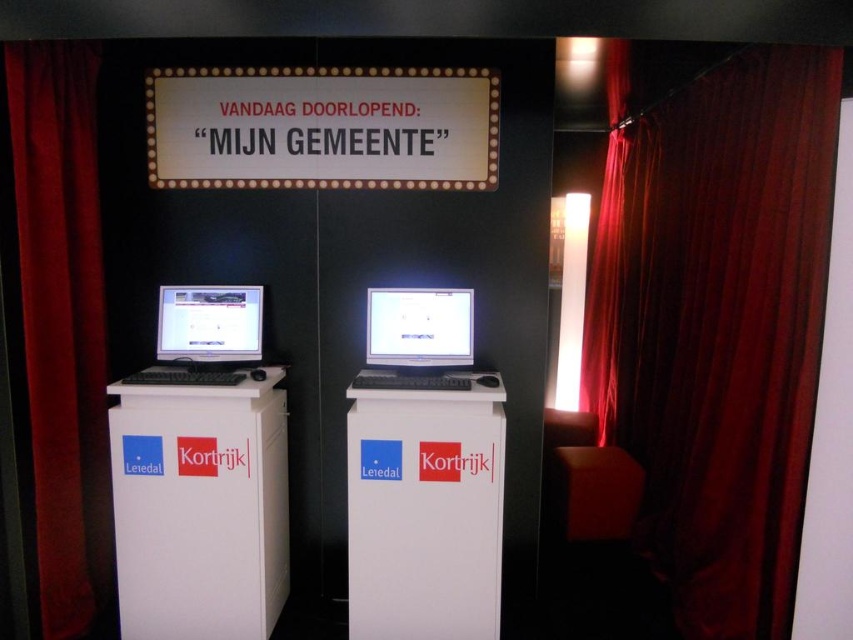
You are setting up for an event and need to decide whether to place a 12cm wide decorative item between the velvet dark red curtain at right and the matte black monitor at center. Based on their widths, will there be enough space for the item?

The velvet dark red curtain at right is thinner than the matte black monitor at center. Since the curtain is thinner, the space between them might be sufficient for the 12cm wide decorative item, but exact measurements are needed for certainty.

You are an event organizer who needs to adjust the lighting for a presentation. The velvet red curtain at left is currently blocking the view of the matte black monitor at center. Can you move the curtain to improve visibility of the monitor?

The velvet red curtain at left is positioned over matte black monitor at center, so moving it would improve visibility.